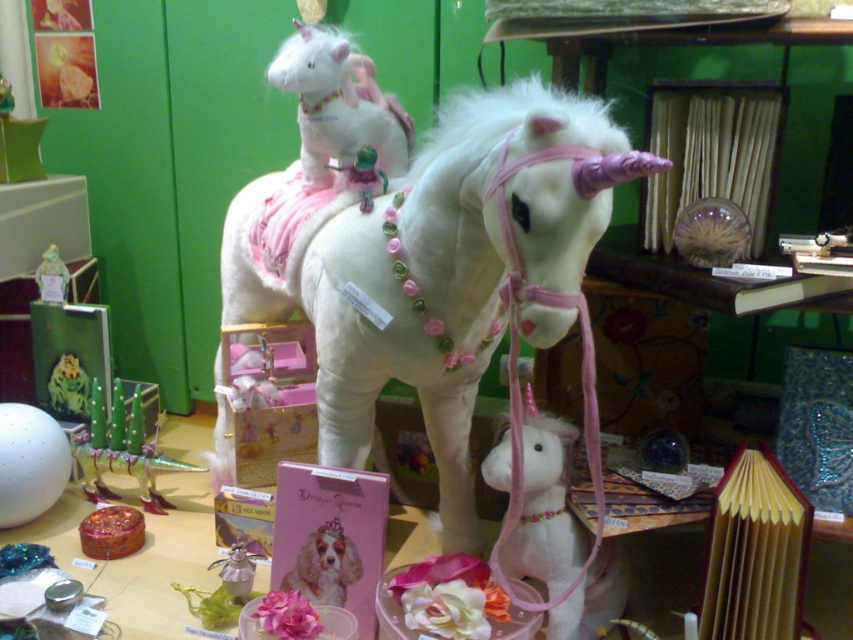
Question: Does white plush unicorn at upper left lie in front of metallic silver figurine at center?

Choices:
 (A) yes
 (B) no

Answer: (B)

Question: Which of the following is the closest to the observer?

Choices:
 (A) metallic silver figurine at center
 (B) white plush horse at center
 (C) metallic silver toy at lower left
 (D) matte plastic unicorn at center

Answer: (B)

Question: Which object appears closest to the camera in this image?

Choices:
 (A) metallic silver toy at lower left
 (B) white plush horse at center
 (C) metallic silver figurine at center
 (D) white plush unicorn at upper left

Answer: (B)

Question: Can you confirm if white plush unicorn at upper left is positioned to the left of metallic silver figurine at center?

Choices:
 (A) yes
 (B) no

Answer: (B)

Question: Can you confirm if white plush horse at center is positioned to the left of white plush unicorn at upper left?

Choices:
 (A) no
 (B) yes

Answer: (A)

Question: Which object is positioned closest to the metallic silver figurine at center?

Choices:
 (A) white plush horse at center
 (B) matte plastic unicorn at center
 (C) white plush unicorn at upper left

Answer: (A)